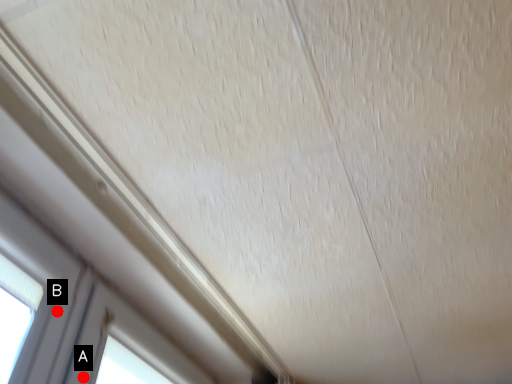
Question: Two points are circled on the image, labeled by A and B beside each circle. Which point is closer to the camera taking this photo?

Choices:
 (A) A is closer
 (B) B is closer

Answer: (B)